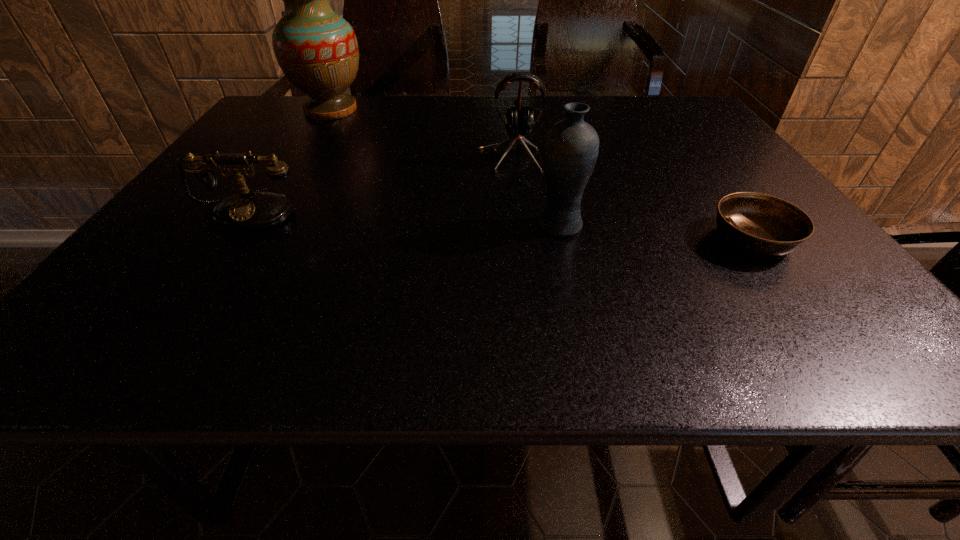
Identify the location of free location located on the right of the shorter vase. (720, 225).

This screenshot has width=960, height=540. I want to click on vacant region located on the back of the second farthest object, so click(506, 126).

You are a GUI agent. You are given a task and a screenshot of the screen. Output one action in this format:
    pyautogui.click(x=<x>, y=<y>)
    Task: Click on the vacant space situated on the dial of the fourth tallest object
    
    Given the screenshot: What is the action you would take?
    pyautogui.click(x=177, y=324)

The width and height of the screenshot is (960, 540). I want to click on vacant space located 0.190m on the back of the shortest object, so click(702, 170).

Where is `object present at the far edge`? The image size is (960, 540). object present at the far edge is located at coordinates (317, 50).

Find the location of a particular element. The height and width of the screenshot is (540, 960). vase present at the left edge is located at coordinates (317, 50).

The height and width of the screenshot is (540, 960). What are the coordinates of `telephone situated at the left edge` in the screenshot? It's located at (249, 210).

Find the location of a particular element. object located in the right edge section of the desktop is located at coordinates (762, 224).

Identify the location of object that is at the far left corner. The height and width of the screenshot is (540, 960). (317, 50).

You are a GUI agent. You are given a task and a screenshot of the screen. Output one action in this format:
    pyautogui.click(x=<x>, y=<y>)
    Task: Click on the free space at the far edge
    
    Given the screenshot: What is the action you would take?
    pyautogui.click(x=531, y=102)